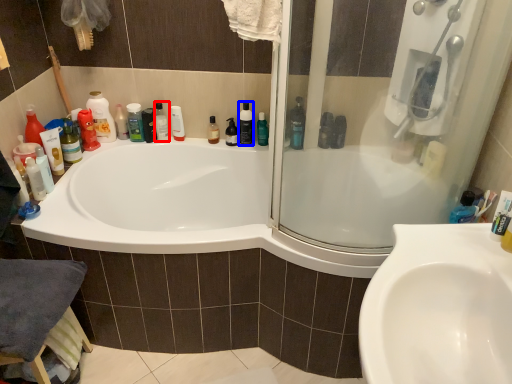
Question: Which object is further to the camera taking this photo, cleaning product (highlighted by a red box) or mouthwash (highlighted by a blue box)?

Choices:
 (A) cleaning product
 (B) mouthwash

Answer: (A)